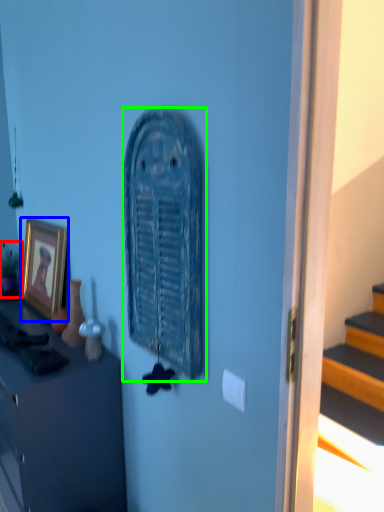
Question: Based on their relative distances, which object is nearer to houseplant (highlighted by a red box)? Choose from picture frame (highlighted by a blue box) and art (highlighted by a green box).

Choices:
 (A) picture frame
 (B) art

Answer: (A)